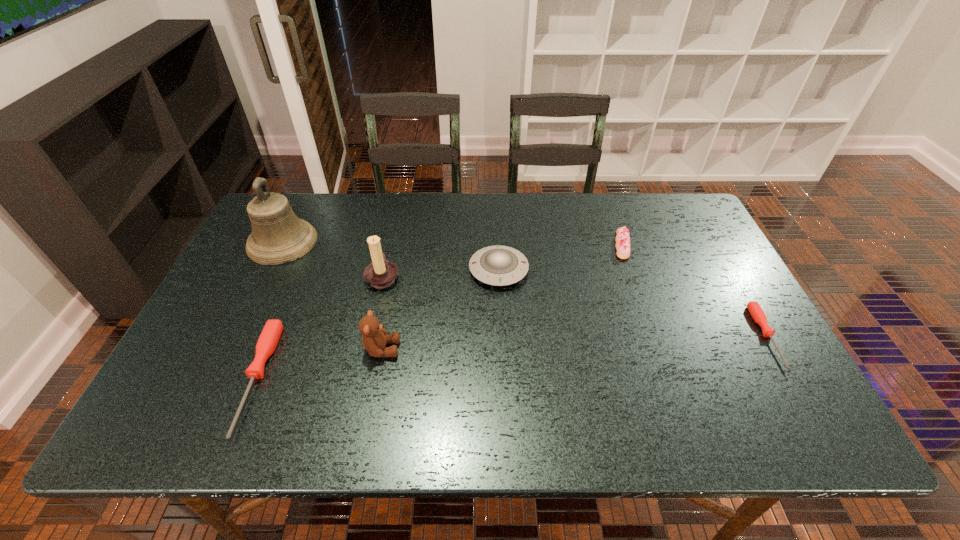
The height and width of the screenshot is (540, 960). Find the location of `free area in between the second object from right to left and the tallest object`. free area in between the second object from right to left and the tallest object is located at coordinates (452, 244).

Find the location of a particular element. The width and height of the screenshot is (960, 540). vacant region between the fourth shortest object and the rightmost object is located at coordinates (633, 303).

At what (x,y) coordinates should I click in order to perform the action: click on vacant space in between the teddy bear and the shortest object. Please return your answer as a coordinate pair (x, y). This screenshot has height=540, width=960. Looking at the image, I should click on (574, 343).

Where is `blank region between the saucer and the rightmost object`? blank region between the saucer and the rightmost object is located at coordinates (633, 303).

What are the coordinates of `empty location between the tallest object and the rightmost object` in the screenshot? It's located at (525, 289).

Where is `free area in between the candle holder and the third object from right to left`? Image resolution: width=960 pixels, height=540 pixels. free area in between the candle holder and the third object from right to left is located at coordinates (441, 273).

The width and height of the screenshot is (960, 540). What are the coordinates of `free point between the shortest object and the left screwdriver` in the screenshot? It's located at (512, 358).

Select which object is the closest to the sixth shortest object. Please provide its 2D coordinates. Your answer should be formatted as a tuple, i.e. [(x, y)], where the tuple contains the x and y coordinates of a point satisfying the conditions above.

[(375, 337)]

Point out which object is positioned as the nearest to the sixth object from left to right. Please provide its 2D coordinates. Your answer should be formatted as a tuple, i.e. [(x, y)], where the tuple contains the x and y coordinates of a point satisfying the conditions above.

[(497, 265)]

Find the location of a particular element. vacant space that satisfies the following two spatial constraints: 1. at the tip of the rightmost object; 2. on the face of the teddy bear is located at coordinates (774, 349).